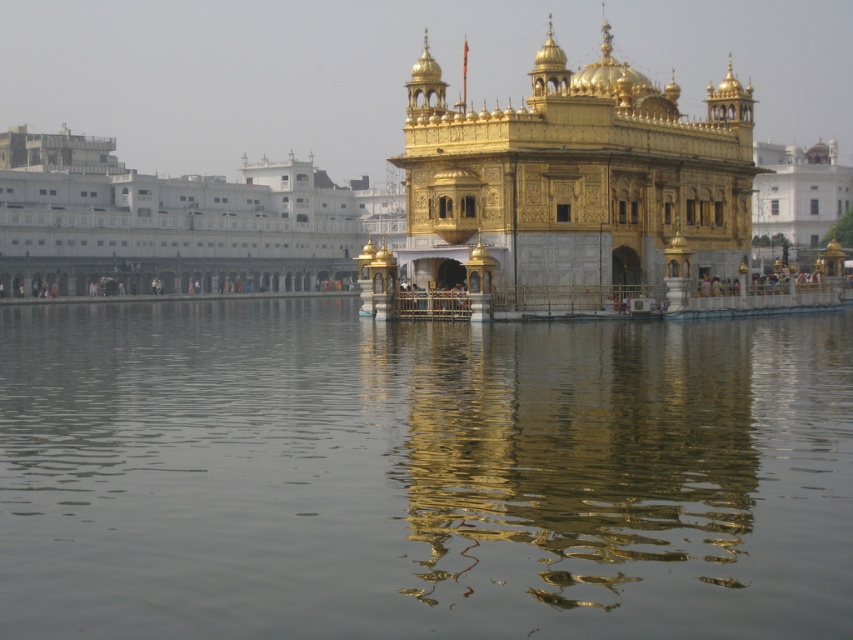
You are a tourist visiting the Golden Temple and want to take a photo that captures both the transparent water at center and the gold polished temple at center. Based on their positions, which object should you place on the left side of your camera frame?

The transparent water at center is positioned on the left side of gold polished temple at center, so you should place the transparent water at center on the left side of your camera frame to capture both in the photo.

You are standing in front of the Golden Temple and want to take a photo of the gold polished temple at center. However, there is transparent water at center in your way. Can you still capture the temple in your photo without the water obstructing it?

The transparent water at center is closer to the viewer than gold polished temple at center, so you can still capture the temple in your photo as the water is transparent and allows the temple to be seen through it.